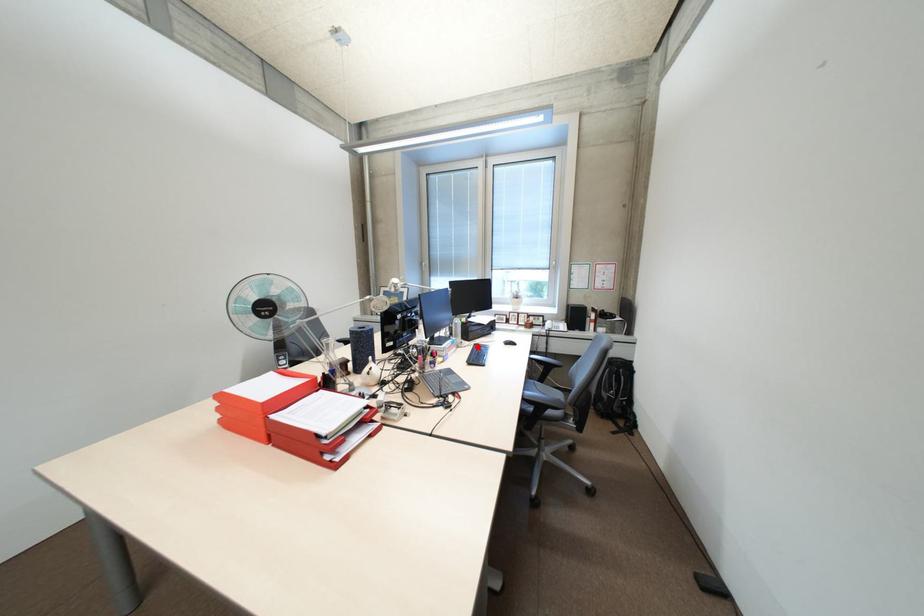
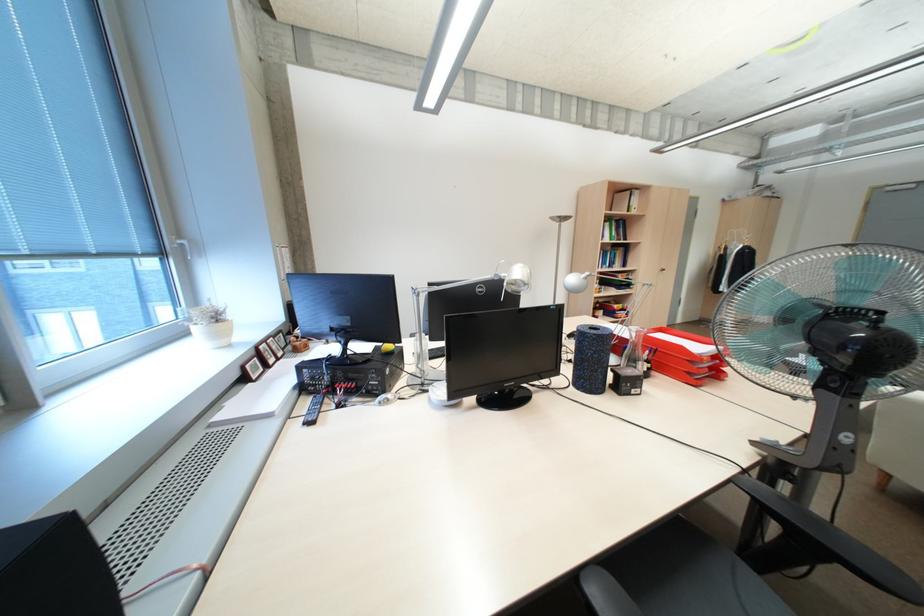
Question: I am providing you with two images of the same scene from different viewpoints. A red point is marked on the first image. At the location where the point appears in image 1, is it still visible in image 2?

Choices:
 (A) Yes
 (B) No

Answer: (B)